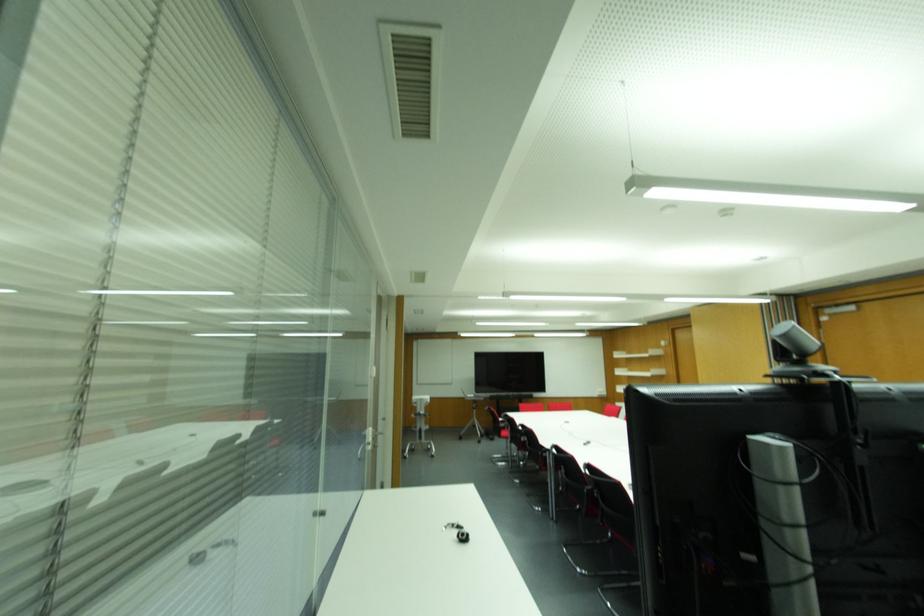
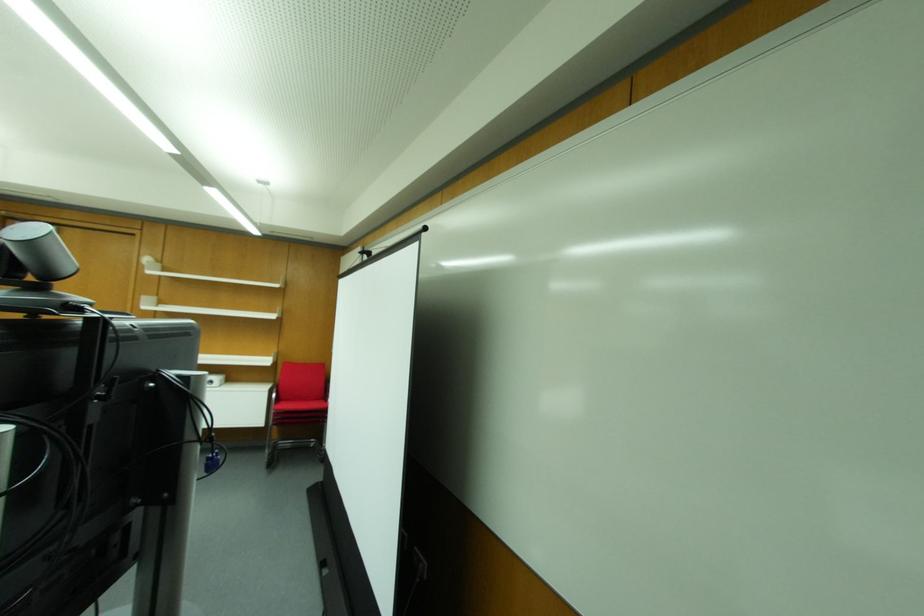
Find the pixel in the second image that matches (784,334) in the first image.

(30, 243)